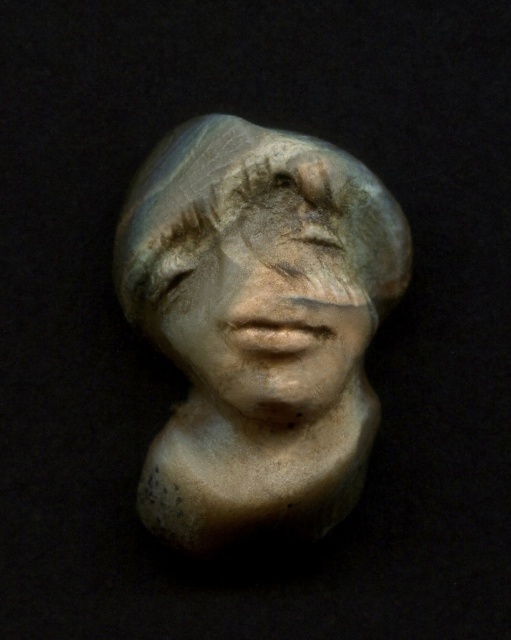
Looking at this image, you are an art conservator examining the sculpted bust. You notice two points on the sculpture labeled as point 1 at coordinates (275, 420) and point 2 at (202, 268). Which point is positioned closer to your viewpoint?

Point 1 at coordinates (275, 420) is closer to the viewer than point 2 at (202, 268).

You are an art conservator examining the sculpture. You notice the matte stone bust at center and the matte stone face at center. Which object is located to the right of the other?

The matte stone face at center is positioned to the right of the matte stone bust at center.

You are an art conservator examining the sculpture. You notice that the matte stone bust at center and the matte stone face at center are positioned in a particular way. Based on their placement, which one is located lower in the image?

The matte stone bust at center is located lower than the matte stone face at center.